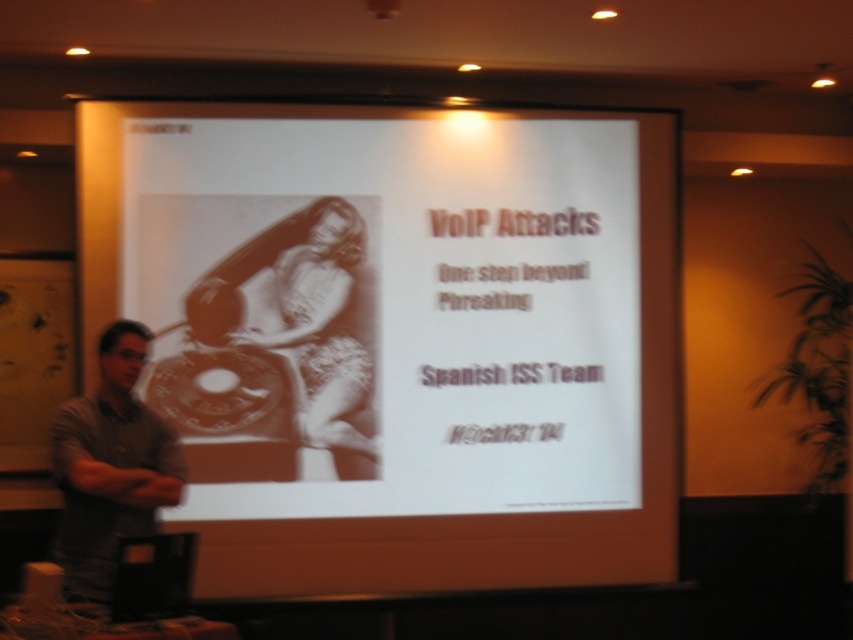
Question: Which object is farther from the camera taking this photo?

Choices:
 (A) white paper at center
 (B) gray casual shirt at left

Answer: (A)

Question: Is white paper at center below gray casual shirt at left?

Choices:
 (A) yes
 (B) no

Answer: (B)

Question: Is white paper at center above gray casual shirt at left?

Choices:
 (A) no
 (B) yes

Answer: (B)

Question: Which point is closer to the camera?

Choices:
 (A) (456, 310)
 (B) (149, 481)

Answer: (B)

Question: Is white paper at center to the right of gray casual shirt at left from the viewer's perspective?

Choices:
 (A) yes
 (B) no

Answer: (A)